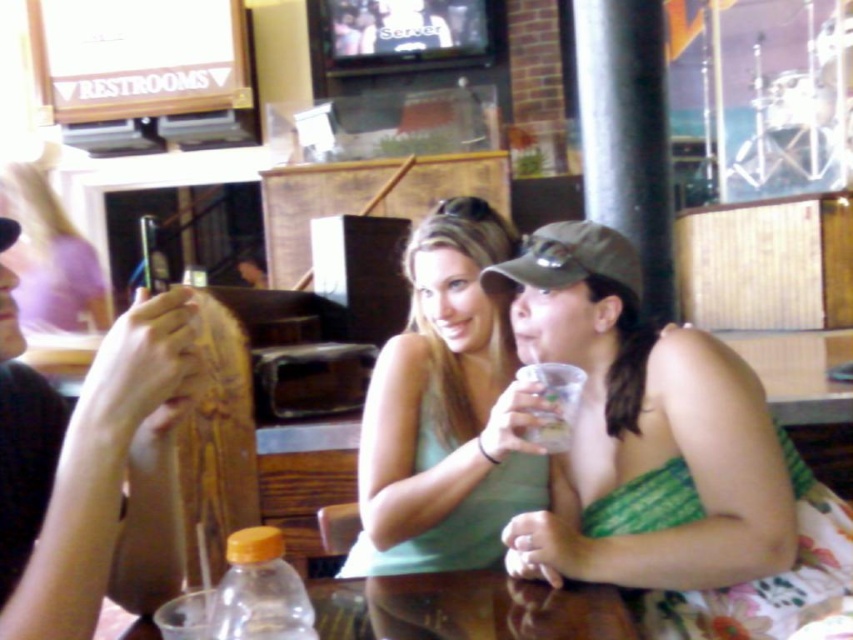
You are standing at the table where the two people are sitting. You need to reach both point A at coordinates point (496,556) and point B at coordinates point (384,596). Which point will you reach first if you move directly towards them?

Point B at coordinates point (384,596) will be reached first because it is closer to you than point A at coordinates point (496,556), which is further away.

You are a waiter in a restaurant. You need to place a new drink order for the customer seated at the brown wooden table at lower center. Where should you place the drink so it doesn not obstruct the clear plastic cup at lower center?

Since the brown wooden table at lower center is closer to the viewer than the clear plastic cup at lower center, you should place the new drink order on the table surface away from the area where the clear plastic cup at lower center is located to avoid obstruction.

You are a waiter in a restaurant. You need to place a 12 inch long tray between the green matte tank top at center and the brown wooden table at lower center. Is there enough space?

The distance between the green matte tank top at center and the brown wooden table at lower center is 11.08 inches, which is less than the 12 inch long tray. Therefore, there is not enough space to place the tray between them.